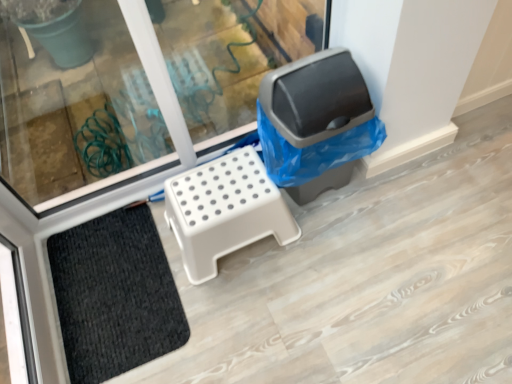
Find the location of `vacant area that is situated to the right of white plastic step stool at center`. vacant area that is situated to the right of white plastic step stool at center is located at coordinates (336, 243).